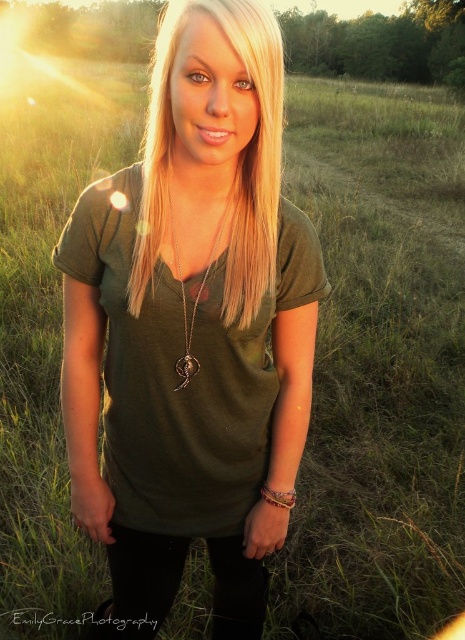
Question: Is olive green t-shirt at center further to camera compared to silver metallic pendant at center?

Choices:
 (A) yes
 (B) no

Answer: (B)

Question: Does olive green t-shirt at center come behind silver metallic pendant at center?

Choices:
 (A) yes
 (B) no

Answer: (B)

Question: Considering the relative positions of olive green t-shirt at center and silver metallic pendant at center in the image provided, where is olive green t-shirt at center located with respect to silver metallic pendant at center?

Choices:
 (A) left
 (B) right

Answer: (A)

Question: Which is farther from the silver metallic pendant at center?

Choices:
 (A) blonde silky hair at center
 (B) olive green t-shirt at center

Answer: (A)

Question: Which point is closer to the camera?

Choices:
 (A) (259, 220)
 (B) (139, 557)

Answer: (A)

Question: Among these points, which one is farthest from the camera?

Choices:
 (A) (239, 1)
 (B) (297, 308)

Answer: (B)